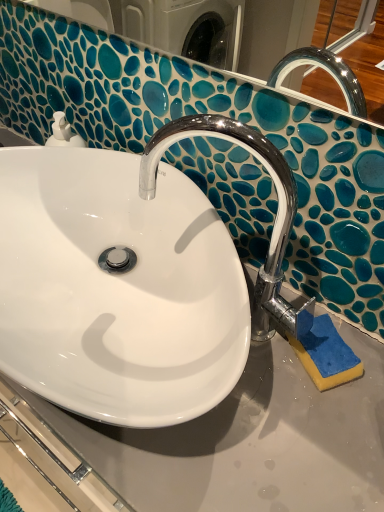
What are the coordinates of `empty space that is in between white glossy sink at center and blue sponge at lower right` in the screenshot? It's located at (266, 421).